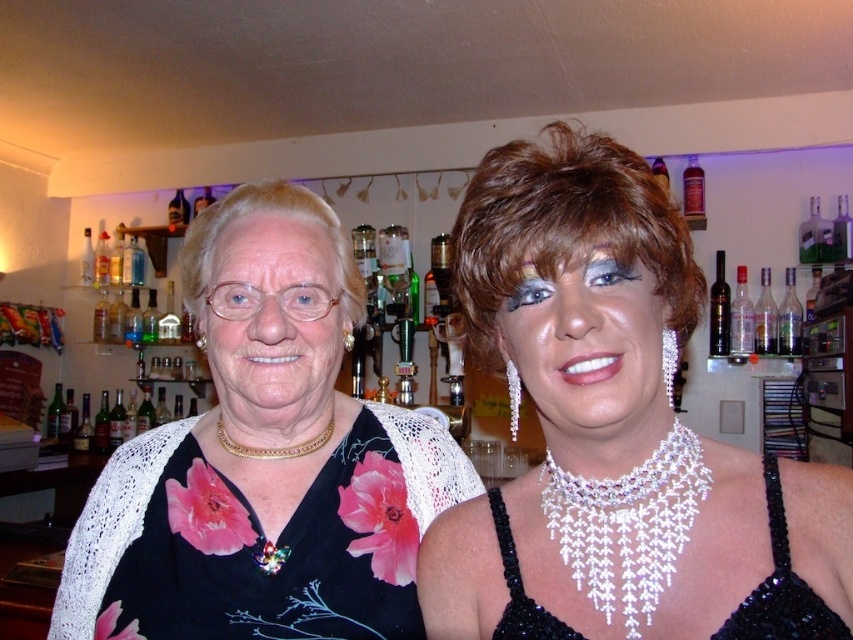
Question: Which object appears closest to the camera in this image?

Choices:
 (A) translucent glass bottle at upper right
 (B) matte black dress at center
 (C) gold metallic necklace at center
 (D) white beaded necklace at center

Answer: (D)

Question: Does matte black dress at center have a greater width compared to sparkly black dress at center?

Choices:
 (A) yes
 (B) no

Answer: (A)

Question: Which object is closer to the camera taking this photo?

Choices:
 (A) pearl-like beaded necklace at center
 (B) matte black dress at center
 (C) gold metallic earring at center
 (D) dark glass bottle at center

Answer: (A)

Question: Which point appears farthest from the camera in this image?

Choices:
 (A) (115, 420)
 (B) (241, 323)
 (C) (270, 452)

Answer: (A)

Question: Is dark glass bottle at center closer to camera compared to translucent glass bottle at upper right?

Choices:
 (A) yes
 (B) no

Answer: (A)

Question: Can you confirm if shiny white face at center is bigger than pearl-like beaded necklace at center?

Choices:
 (A) no
 (B) yes

Answer: (B)